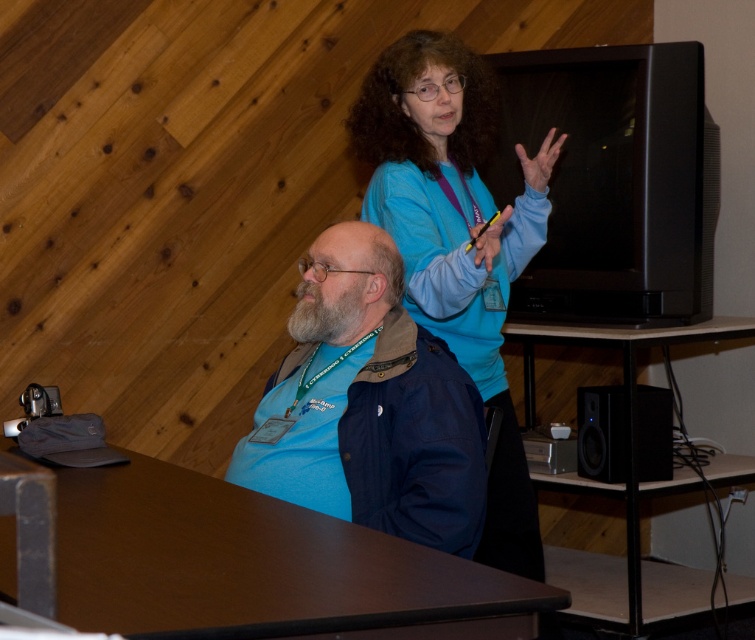
You are standing in the conference room and need to reach both the blue denim jacket at center and the blue fabric shirt at upper center. Which item is easier to reach without moving your current position?

The blue denim jacket at center is easier to reach because it is closer to the viewer compared to the blue fabric shirt at upper center.

You are a photographer setting up for an event. You need to position a camera so that both the blue fabric shirt at upper center and the black plastic speaker at lower right are in frame. Considering their heights, which object should you adjust the camera angle to focus on first?

The blue fabric shirt at upper center has a greater height compared to the black plastic speaker at lower right. To ensure both are in frame, adjust the camera angle to focus on the blue fabric shirt at upper center first, then lower slightly to include the black plastic speaker at lower right.

You are a delivery robot in a conference room. You need to place a package on the brown wood table at lower left. There is a dry skin hand at upper center reaching towards the table. Can you safely place the package on the table without the hand interfering?

The brown wood table at lower left and dry skin hand at upper center are 1.38 meters apart. Since the distance is sufficient, the robot can safely place the package on the table without the hand interfering.